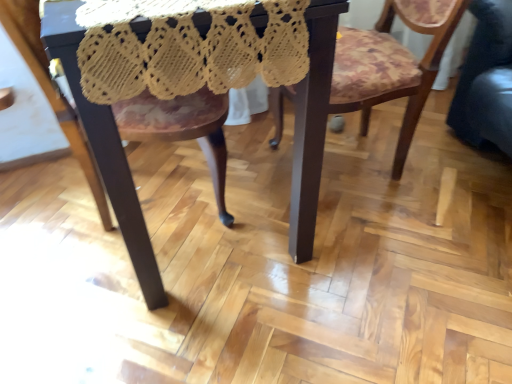
At what (x,y) coordinates should I click in order to perform the action: click on free spot in front of wooden floral-patterned chair at center, acting as the second chair starting from the left. Please return your answer as a coordinate pair (x, y). The height and width of the screenshot is (384, 512). Looking at the image, I should click on (386, 251).